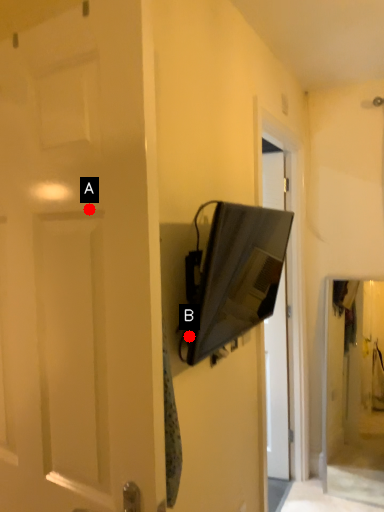
Question: Two points are circled on the image, labeled by A and B beside each circle. Which point is closer to the camera?

Choices:
 (A) A is closer
 (B) B is closer

Answer: (A)